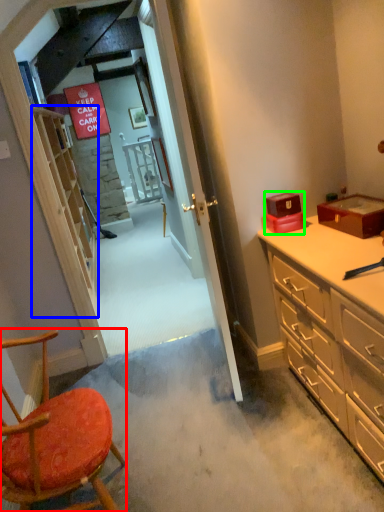
Question: Which object is the farthest from chair (highlighted by a red box)? Choose among these: shelf (highlighted by a blue box) or box (highlighted by a green box).

Choices:
 (A) shelf
 (B) box

Answer: (A)